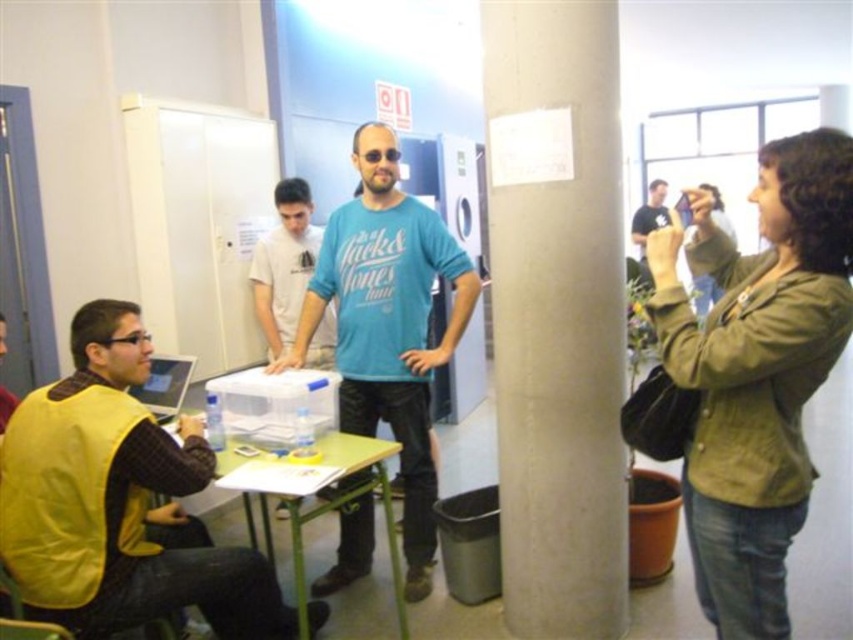
Looking at this image, you are standing at the entrance of the room and want to locate the blue cotton shirt at center. According to the coordinates provided, where should you look to find it?

The blue cotton shirt at center is located at coordinates point [387,324], which would be in the central area of the image.

You are standing in the office and need to place a new plant on the white plastic container at center. Considering the concrete pillar at center is below it, will the plant be visible from the front of the container?

The concrete pillar at center is located below the white plastic container at center, so placing the plant on the container will keep it visible from the front as the pillar does not block the view.